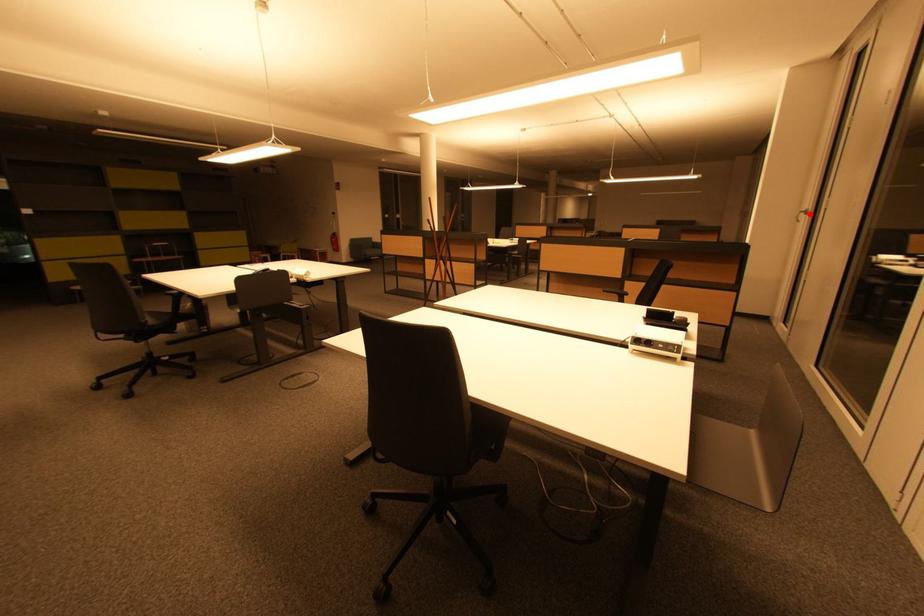
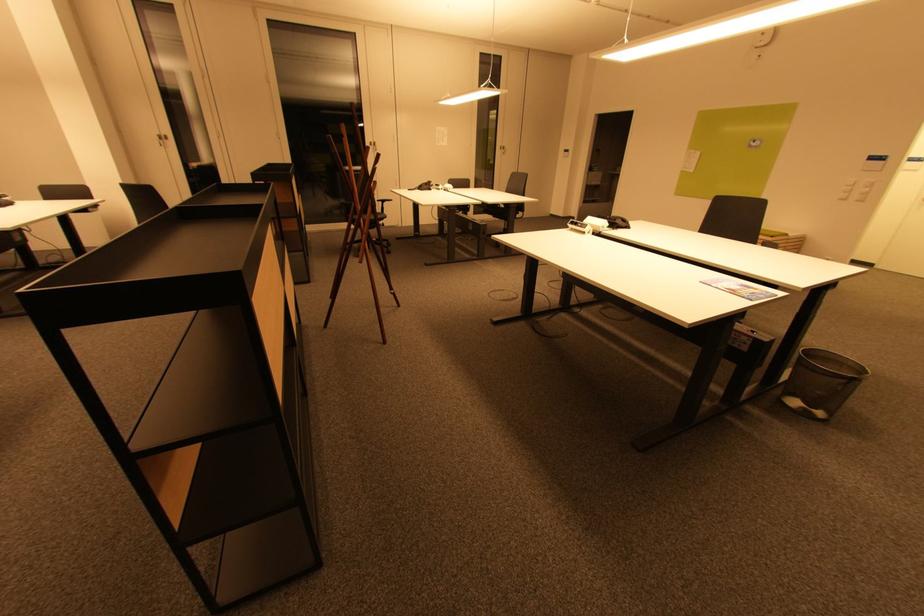
Question: I am providing you with two images of the same scene from different viewpoints. In image1, a red point is highlighted. Considering the same 3D point in image2, which of the following is correct?

Choices:
 (A) It is closer
 (B) It is farther

Answer: (B)